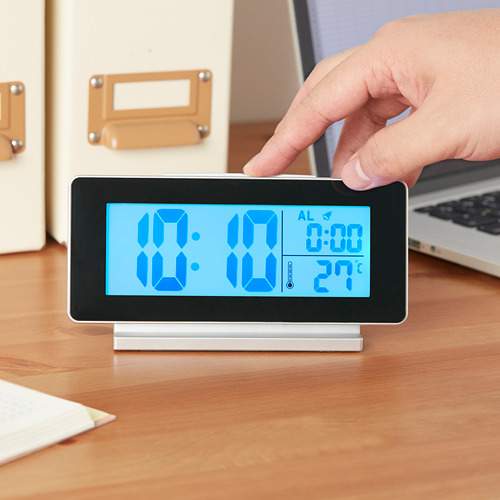
Locate an element on the screen. laptop is located at coordinates pos(467,235).